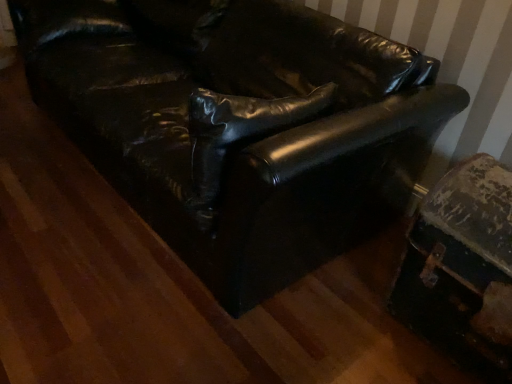
Describe the element at coordinates (462, 268) in the screenshot. I see `rusty metal trunk at lower right` at that location.

Identify the location of rusty metal trunk at lower right. This screenshot has width=512, height=384. [x=462, y=268].

I want to click on rusty metal trunk at lower right, so (x=462, y=268).